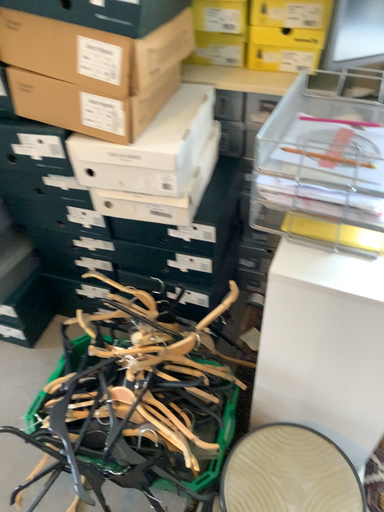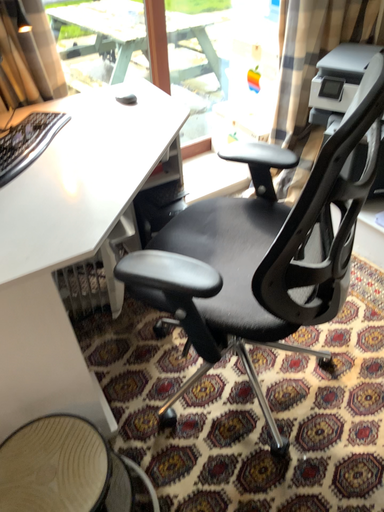
Question: Which way did the camera rotate in the video?

Choices:
 (A) rotated left
 (B) rotated right

Answer: (B)